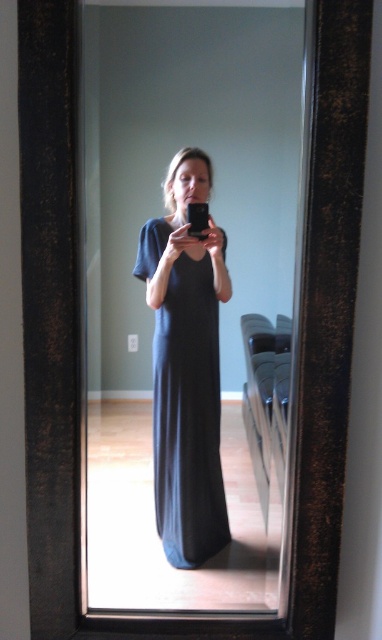
Question: Can you confirm if black matte dress at center is bigger than dark blue jersey dress at center?

Choices:
 (A) no
 (B) yes

Answer: (B)

Question: Which object appears farthest from the camera in this image?

Choices:
 (A) dark blue jersey dress at center
 (B) black matte dress at center

Answer: (A)

Question: Where is black matte dress at center located in relation to dark blue jersey dress at center in the image?

Choices:
 (A) below
 (B) above

Answer: (B)

Question: Is black matte dress at center wider than dark blue jersey dress at center?

Choices:
 (A) yes
 (B) no

Answer: (A)